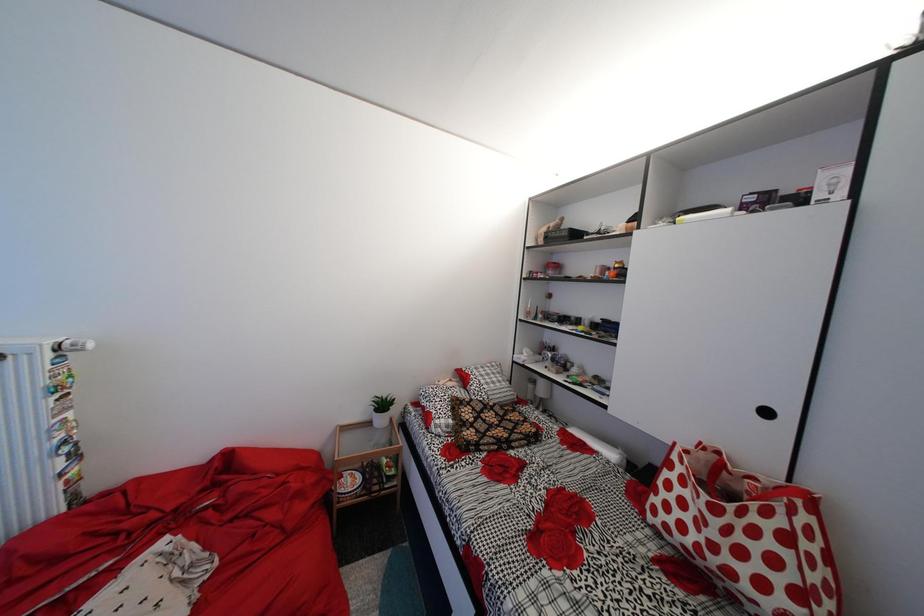
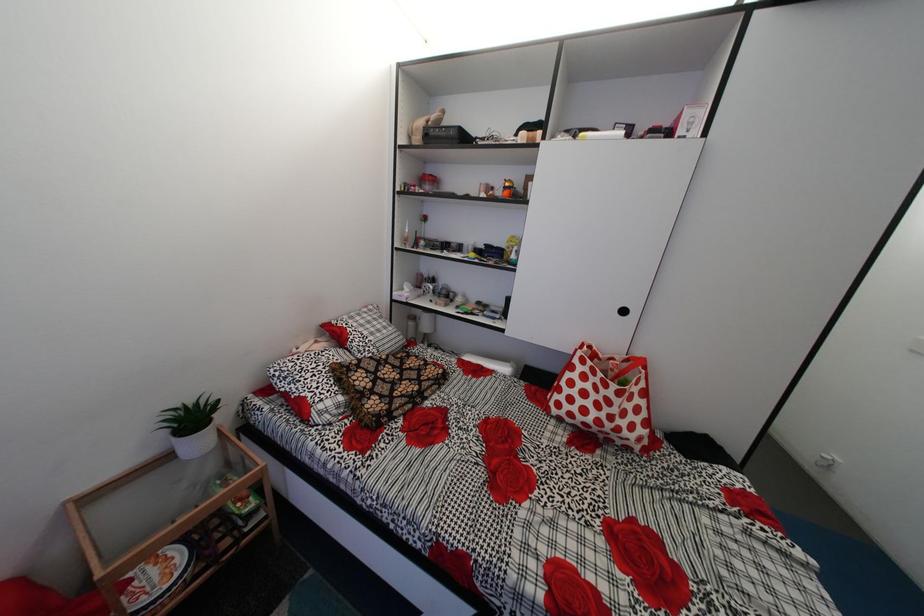
Based on the continuous images, in which direction is the camera rotating?

The rotation direction of the camera is right-down.